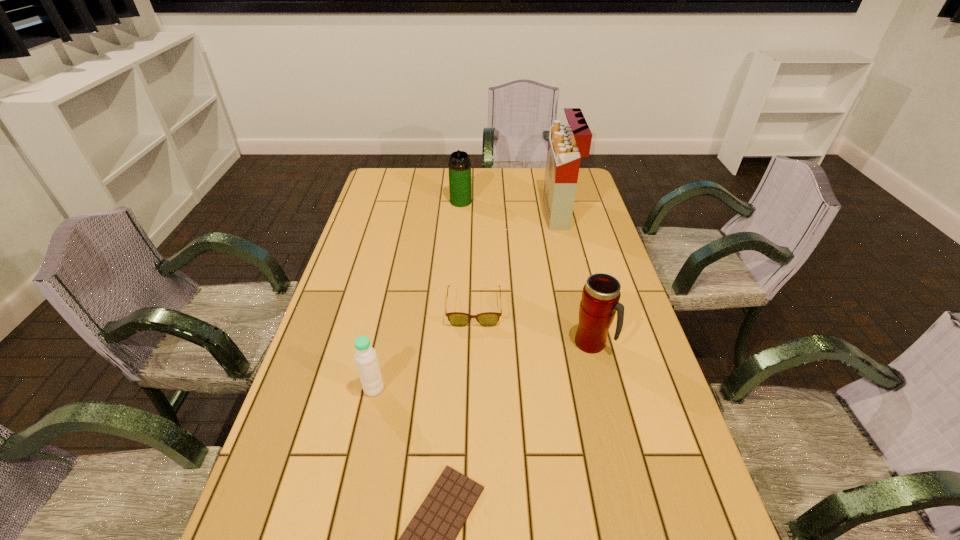
The height and width of the screenshot is (540, 960). What are the coordinates of `the tallest object` in the screenshot? It's located at (567, 143).

Image resolution: width=960 pixels, height=540 pixels. What are the coordinates of `the farther thermos bottle` in the screenshot? It's located at (459, 166).

At what (x,y) coordinates should I click in order to perform the action: click on the third nearest object. Please return your answer as a coordinate pair (x, y). The width and height of the screenshot is (960, 540). Looking at the image, I should click on (600, 299).

Find the location of a particular element. Image resolution: width=960 pixels, height=540 pixels. the nearer thermos bottle is located at coordinates (600, 299).

You are a GUI agent. You are given a task and a screenshot of the screen. Output one action in this format:
    pyautogui.click(x=<x>, y=<y>)
    Task: Click on the fifth farthest object
    
    Given the screenshot: What is the action you would take?
    pyautogui.click(x=365, y=356)

Identify the location of water bottle. (365, 356).

You are a GUI agent. You are given a task and a screenshot of the screen. Output one action in this format:
    pyautogui.click(x=<x>, y=<y>)
    Task: Click on the spectacles
    
    Given the screenshot: What is the action you would take?
    pyautogui.click(x=458, y=319)

Locate an element on the screen. The height and width of the screenshot is (540, 960). the fourth nearest object is located at coordinates (458, 319).

This screenshot has height=540, width=960. I want to click on vacant region located with the lid open on the cigarette case, so click(x=495, y=213).

At what (x,y) coordinates should I click in order to perform the action: click on vacant space located with the lid open on the cigarette case. Please return your answer as a coordinate pair (x, y). Looking at the image, I should click on (442, 213).